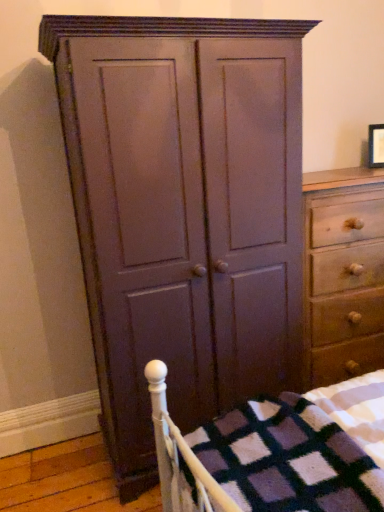
Question: Is light brown wood chest of drawers at right oriented towards matte wood cupboard at center?

Choices:
 (A) no
 (B) yes

Answer: (A)

Question: From the image's perspective, is light brown wood chest of drawers at right beneath matte wood cupboard at center?

Choices:
 (A) no
 (B) yes

Answer: (B)

Question: From a real-world perspective, is light brown wood chest of drawers at right positioned under matte wood cupboard at center based on gravity?

Choices:
 (A) yes
 (B) no

Answer: (A)

Question: Can you confirm if light brown wood chest of drawers at right is positioned to the left of matte wood cupboard at center?

Choices:
 (A) no
 (B) yes

Answer: (A)

Question: Is light brown wood chest of drawers at right turned away from matte wood cupboard at center?

Choices:
 (A) yes
 (B) no

Answer: (B)

Question: Is point (375, 159) positioned closer to the camera than point (365, 183)?

Choices:
 (A) farther
 (B) closer

Answer: (A)

Question: Is matte black picture frame at upper right inside or outside of light brown wood chest of drawers at right?

Choices:
 (A) outside
 (B) inside

Answer: (A)

Question: From the image's perspective, relative to light brown wood chest of drawers at right, is matte black picture frame at upper right above or below?

Choices:
 (A) above
 (B) below

Answer: (A)

Question: Relative to light brown wood chest of drawers at right, is matte black picture frame at upper right in front or behind?

Choices:
 (A) front
 (B) behind

Answer: (B)

Question: Considering the positions of point (x=99, y=285) and point (x=350, y=297), is point (x=99, y=285) closer or farther from the camera than point (x=350, y=297)?

Choices:
 (A) closer
 (B) farther

Answer: (A)

Question: Is matte wood cupboard at center spatially inside light brown wood chest of drawers at right, or outside of it?

Choices:
 (A) inside
 (B) outside

Answer: (B)

Question: Considering their positions, is matte wood cupboard at center located in front of or behind light brown wood chest of drawers at right?

Choices:
 (A) behind
 (B) front

Answer: (B)

Question: Considering the positions of matte wood cupboard at center and light brown wood chest of drawers at right in the image, is matte wood cupboard at center taller or shorter than light brown wood chest of drawers at right?

Choices:
 (A) short
 (B) tall

Answer: (B)

Question: From the image's perspective, relative to matte black picture frame at upper right, is light brown wood chest of drawers at right above or below?

Choices:
 (A) above
 (B) below

Answer: (B)

Question: Is point (345, 309) closer or farther from the camera than point (369, 137)?

Choices:
 (A) closer
 (B) farther

Answer: (A)